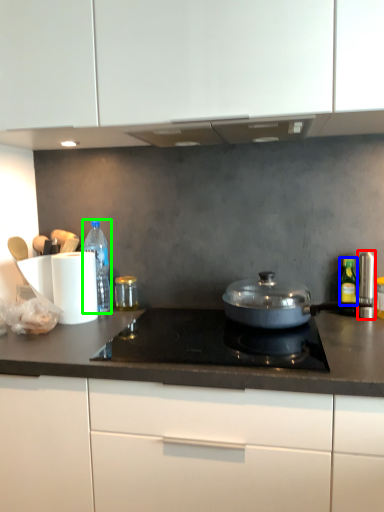
Question: Which object is the farthest from appliance (highlighted by a red box)? Choose among these: bottle (highlighted by a blue box) or bottle (highlighted by a green box).

Choices:
 (A) bottle
 (B) bottle

Answer: (B)